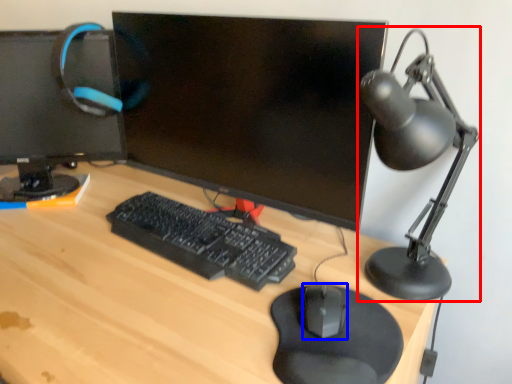
Question: Which object is closer to the camera taking this photo, table lamp (highlighted by a red box) or mouse (highlighted by a blue box)?

Choices:
 (A) table lamp
 (B) mouse

Answer: (A)